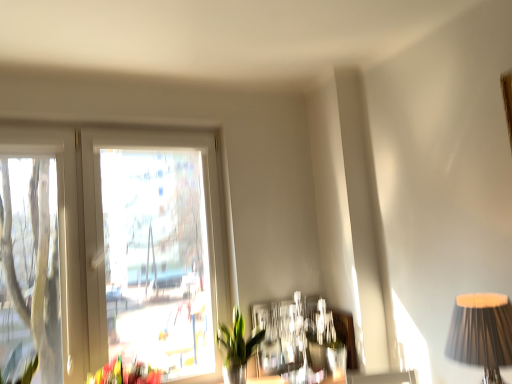
Question: From the image's perspective, is green leafy plant at left on green glossy plant at lower center?

Choices:
 (A) yes
 (B) no

Answer: (A)

Question: From a real-world perspective, is green leafy plant at left physically below green glossy plant at lower center?

Choices:
 (A) no
 (B) yes

Answer: (A)

Question: Does green leafy plant at left have a greater height compared to green glossy plant at lower center?

Choices:
 (A) no
 (B) yes

Answer: (A)

Question: Considering the relative positions of green leafy plant at left and green glossy plant at lower center in the image provided, is green leafy plant at left behind green glossy plant at lower center?

Choices:
 (A) yes
 (B) no

Answer: (B)

Question: Would you consider green leafy plant at left to be distant from green glossy plant at lower center?

Choices:
 (A) yes
 (B) no

Answer: (A)

Question: Based on their positions, is black pleated fabric lampshade at right located to the left or right of green glossy plant at lower center?

Choices:
 (A) right
 (B) left

Answer: (A)

Question: Based on their sizes in the image, would you say black pleated fabric lampshade at right is bigger or smaller than green glossy plant at lower center?

Choices:
 (A) big
 (B) small

Answer: (A)

Question: From their relative heights in the image, would you say black pleated fabric lampshade at right is taller or shorter than green glossy plant at lower center?

Choices:
 (A) short
 (B) tall

Answer: (A)

Question: From the image's perspective, is black pleated fabric lampshade at right located above or below green glossy plant at lower center?

Choices:
 (A) below
 (B) above

Answer: (B)

Question: In the image, is white plastic window at upper left on the left side or the right side of black pleated fabric lampshade at right?

Choices:
 (A) left
 (B) right

Answer: (A)

Question: In the image, is white plastic window at upper left positioned in front of or behind black pleated fabric lampshade at right?

Choices:
 (A) front
 (B) behind

Answer: (B)

Question: From a real-world perspective, is white plastic window at upper left physically located above or below black pleated fabric lampshade at right?

Choices:
 (A) below
 (B) above

Answer: (B)

Question: Is white plastic window at upper left wider or thinner than black pleated fabric lampshade at right?

Choices:
 (A) wide
 (B) thin

Answer: (B)

Question: From the image's perspective, is white plastic window at upper left located above or below green leafy plant at left?

Choices:
 (A) above
 (B) below

Answer: (A)

Question: Is point (97, 165) closer or farther from the camera than point (32, 367)?

Choices:
 (A) closer
 (B) farther

Answer: (B)